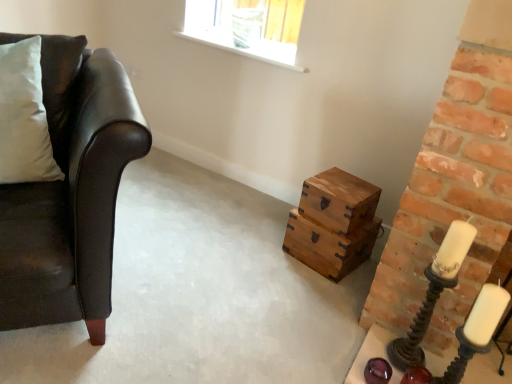
Question: From the image's perspective, would you say wooden box at center is shown under metallic spiral candle holder at right, which is the 1th candle holder in left-to-right order?

Choices:
 (A) no
 (B) yes

Answer: (A)

Question: Does wooden box at center come in front of metallic spiral candle holder at right, which is the 1th candle holder in left-to-right order?

Choices:
 (A) yes
 (B) no

Answer: (B)

Question: From a real-world perspective, is wooden box at center below metallic spiral candle holder at right, the second candle holder in the right-to-left sequence?

Choices:
 (A) yes
 (B) no

Answer: (A)

Question: Can we say wooden box at center lies outside metallic spiral candle holder at right, which is the 1th candle holder in left-to-right order?

Choices:
 (A) no
 (B) yes

Answer: (B)

Question: From the image's perspective, is wooden box at center over metallic spiral candle holder at right, the second candle holder in the right-to-left sequence?

Choices:
 (A) yes
 (B) no

Answer: (A)

Question: Visually, is matte black leather couch at left positioned to the left or to the right of white wax candle at right?

Choices:
 (A) right
 (B) left

Answer: (B)

Question: Considering the positions of matte black leather couch at left and white wax candle at right in the image, is matte black leather couch at left wider or thinner than white wax candle at right?

Choices:
 (A) wide
 (B) thin

Answer: (A)

Question: Is matte black leather couch at left in front of or behind white wax candle at right in the image?

Choices:
 (A) behind
 (B) front

Answer: (B)

Question: Based on their sizes in the image, would you say matte black leather couch at left is bigger or smaller than white wax candle at right?

Choices:
 (A) big
 (B) small

Answer: (A)

Question: Is point (66, 235) positioned closer to the camera than point (331, 175)?

Choices:
 (A) closer
 (B) farther

Answer: (A)

Question: Considering the positions of matte black leather couch at left and wooden box at center in the image, is matte black leather couch at left bigger or smaller than wooden box at center?

Choices:
 (A) big
 (B) small

Answer: (A)

Question: Considering their positions, is matte black leather couch at left located in front of or behind wooden box at center?

Choices:
 (A) front
 (B) behind

Answer: (A)

Question: Is matte black leather couch at left wider or thinner than wooden box at center?

Choices:
 (A) wide
 (B) thin

Answer: (A)

Question: From a real-world perspective, is matte black leather couch at left positioned above or below matte black candle holder at right, the 1th candle holder in the right-to-left sequence?

Choices:
 (A) above
 (B) below

Answer: (A)

Question: Is point (108, 117) closer or farther from the camera than point (479, 334)?

Choices:
 (A) closer
 (B) farther

Answer: (B)